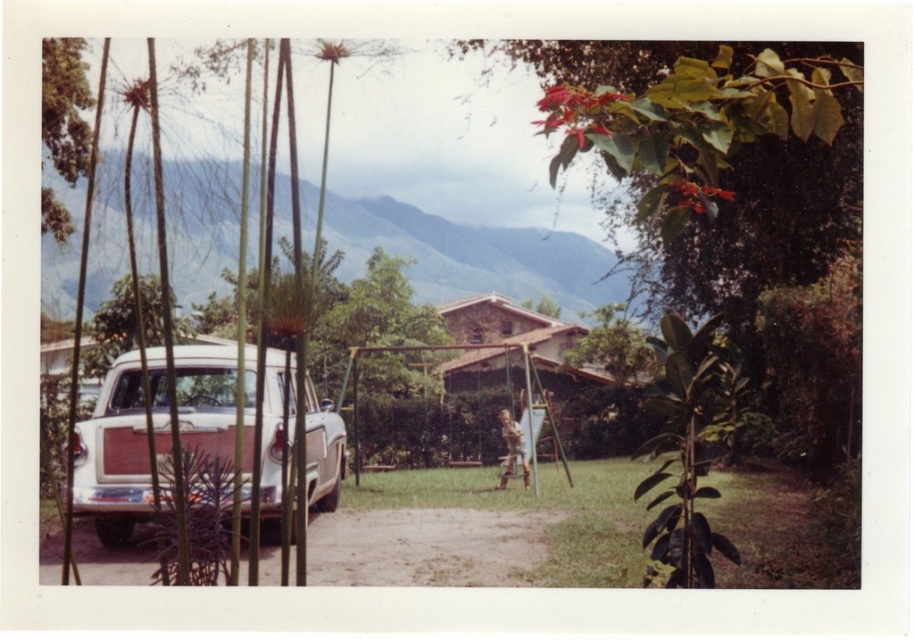
I want to click on matte white station wagon at left, so click(114, 456).

Can you confirm if matte white station wagon at left is bigger than green leafy tree at upper left?

Correct, matte white station wagon at left is larger in size than green leafy tree at upper left.

Find the location of a particular element. The height and width of the screenshot is (640, 914). matte white station wagon at left is located at coordinates 114,456.